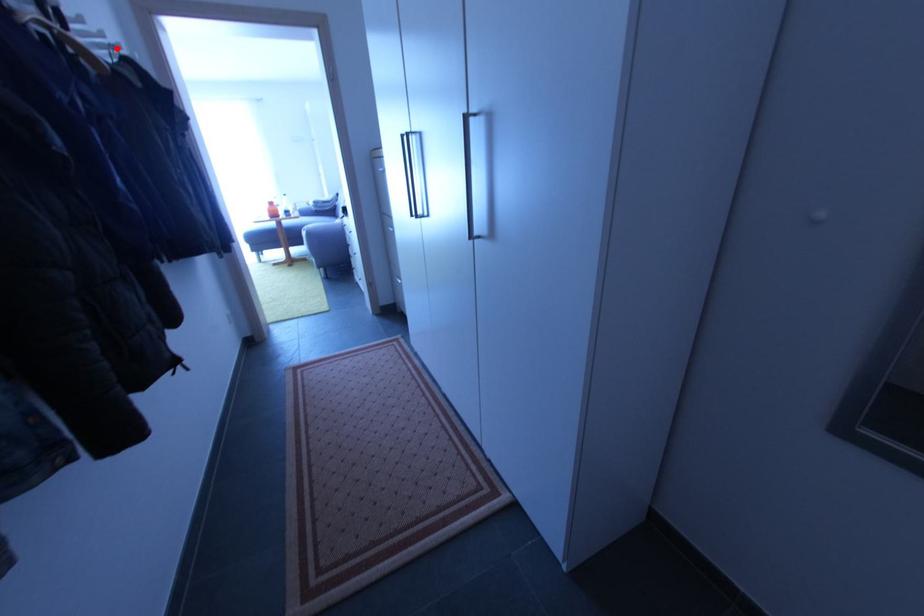
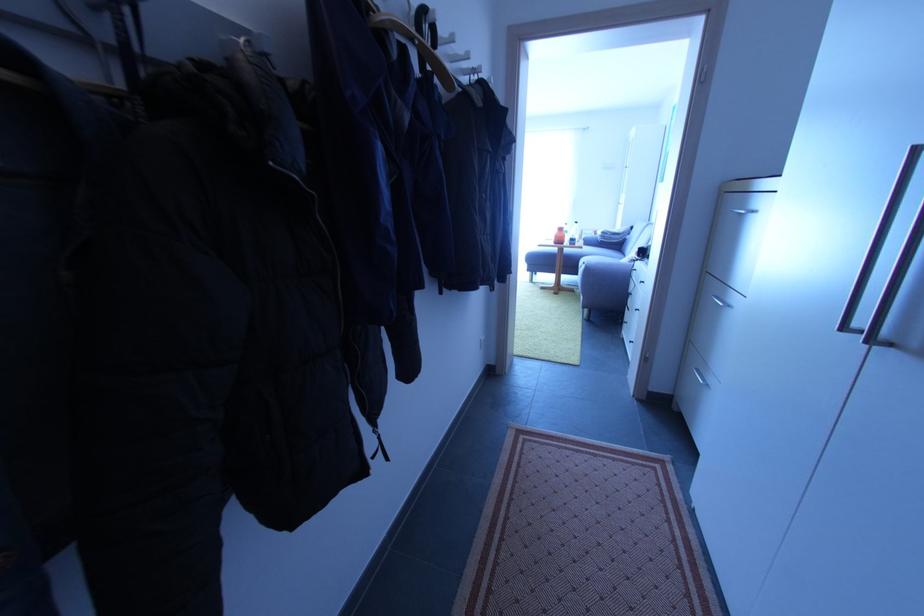
Locate, in the second image, the point that corresponds to the highlighted location in the first image.

(479, 71)